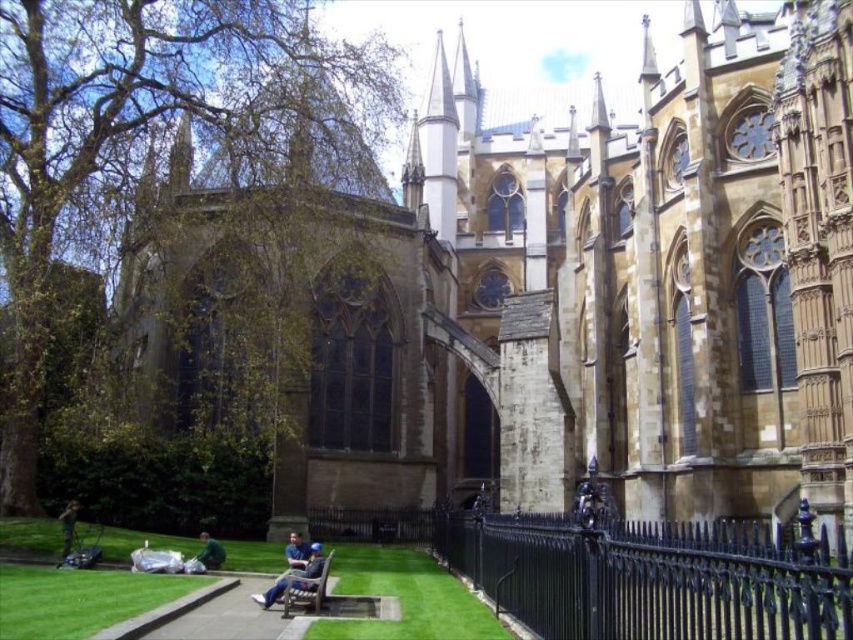
Question: Is blue denim jeans at lower center above dark green jacket at lower left?

Choices:
 (A) no
 (B) yes

Answer: (A)

Question: Which object appears closest to the camera in this image?

Choices:
 (A) blue denim jacket at lower center
 (B) black wrought iron fence at lower right
 (C) green grass at lower left
 (D) wooden bench at center

Answer: (B)

Question: Based on their relative distances, which object is farther from the blue denim jeans at lower center?

Choices:
 (A) green fabric at lower center
 (B) dark green jacket at lower left

Answer: (B)

Question: Which of the following is the closest to the observer?

Choices:
 (A) green grass at lower left
 (B) green fabric at lower center

Answer: (A)

Question: Is black wrought iron fence at lower right in front of green grass at lower left?

Choices:
 (A) yes
 (B) no

Answer: (A)

Question: Considering the relative positions of wooden bench at center and blue denim jeans at lower center in the image provided, where is wooden bench at center located with respect to blue denim jeans at lower center?

Choices:
 (A) left
 (B) right

Answer: (B)